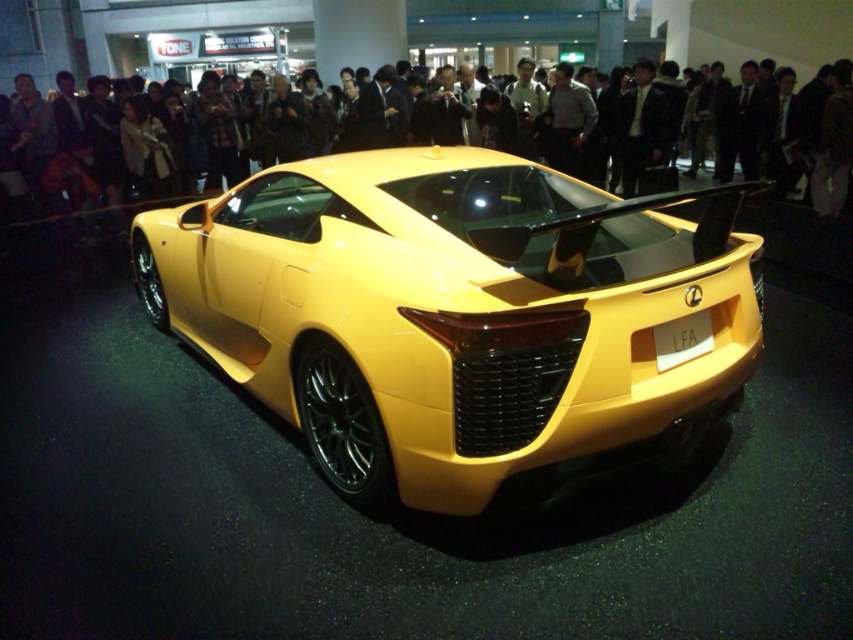
Question: Which point is farther from the camera taking this photo?

Choices:
 (A) (80, 186)
 (B) (688, 417)

Answer: (A)

Question: Which of the following is the farthest from the observer?

Choices:
 (A) matte black crowd at upper center
 (B) yellow matte/solid car at center

Answer: (A)

Question: Does yellow matte/solid car at center come behind matte black crowd at upper center?

Choices:
 (A) yes
 (B) no

Answer: (B)

Question: Can you confirm if yellow matte/solid car at center is positioned to the left of matte black crowd at upper center?

Choices:
 (A) no
 (B) yes

Answer: (B)

Question: From the image, what is the correct spatial relationship of yellow matte/solid car at center in relation to matte black crowd at upper center?

Choices:
 (A) left
 (B) right

Answer: (A)